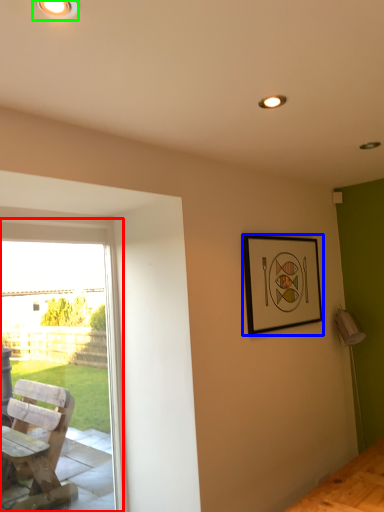
Question: Based on their relative distances, which object is farther from window (highlighted by a red box)? Choose from picture frame (highlighted by a blue box) and light fixture (highlighted by a green box).

Choices:
 (A) picture frame
 (B) light fixture

Answer: (B)